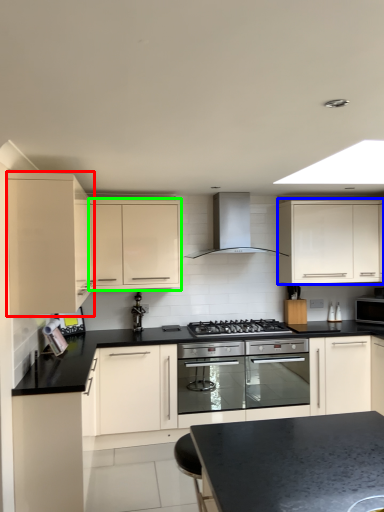
Question: Considering the real-world distances, which object is farthest from cabinetry (highlighted by a red box)? cabinetry (highlighted by a blue box) or cabinetry (highlighted by a green box)?

Choices:
 (A) cabinetry
 (B) cabinetry

Answer: (A)